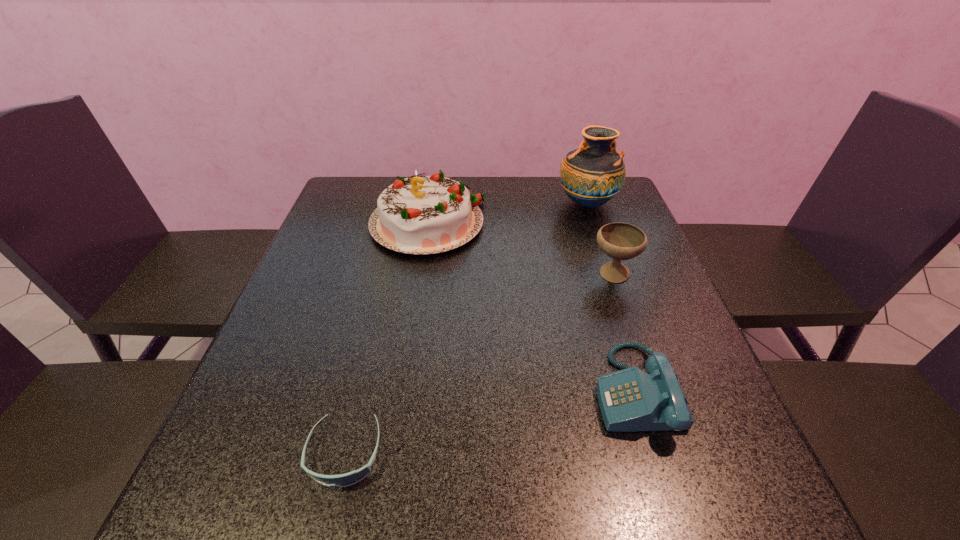
Image resolution: width=960 pixels, height=540 pixels. I want to click on the tallest object, so click(593, 174).

The height and width of the screenshot is (540, 960). What are the coordinates of `cake` in the screenshot? It's located at (420, 215).

You are a GUI agent. You are given a task and a screenshot of the screen. Output one action in this format:
    pyautogui.click(x=<x>, y=<y>)
    Task: Click on the third nearest object
    
    Given the screenshot: What is the action you would take?
    pyautogui.click(x=621, y=241)

Where is `the third shortest object`? The image size is (960, 540). the third shortest object is located at coordinates (621, 241).

Where is `telephone`? telephone is located at coordinates (630, 400).

In order to click on goggles in this screenshot , I will do `click(347, 479)`.

Identify the location of free location located on the front of the tallest object. Image resolution: width=960 pixels, height=540 pixels. (615, 287).

In order to click on free point located 0.050m on the left of the fourth shortest object in this screenshot , I will do `click(352, 224)`.

This screenshot has width=960, height=540. In order to click on vacant space located on the back of the third shortest object in this screenshot , I will do `click(603, 244)`.

At what (x,y) coordinates should I click in order to perform the action: click on free point located on the dial of the fourth tallest object. Please return your answer as a coordinate pair (x, y). The width and height of the screenshot is (960, 540). Looking at the image, I should click on (537, 390).